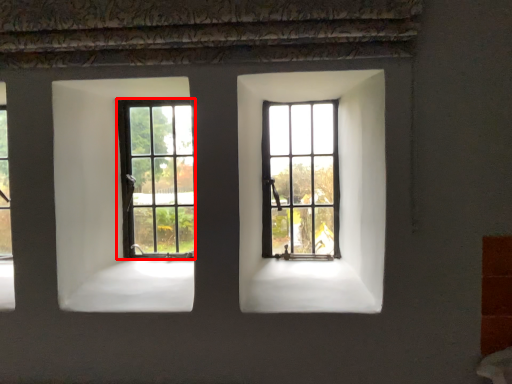
Question: Observing the image, what is the correct spatial positioning of window (annotated by the red box) in reference to window?

Choices:
 (A) left
 (B) right

Answer: (A)